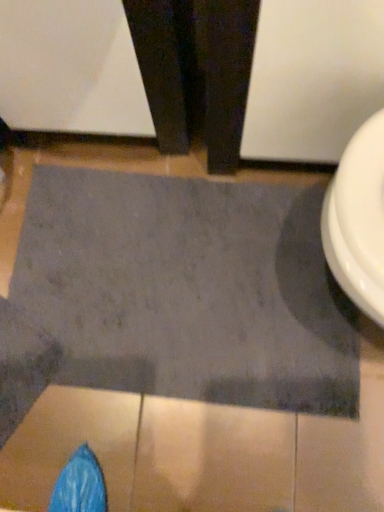
Identify the location of vacant space in dark gray carpet at center (from a real-world perspective). The image size is (384, 512). (161, 282).